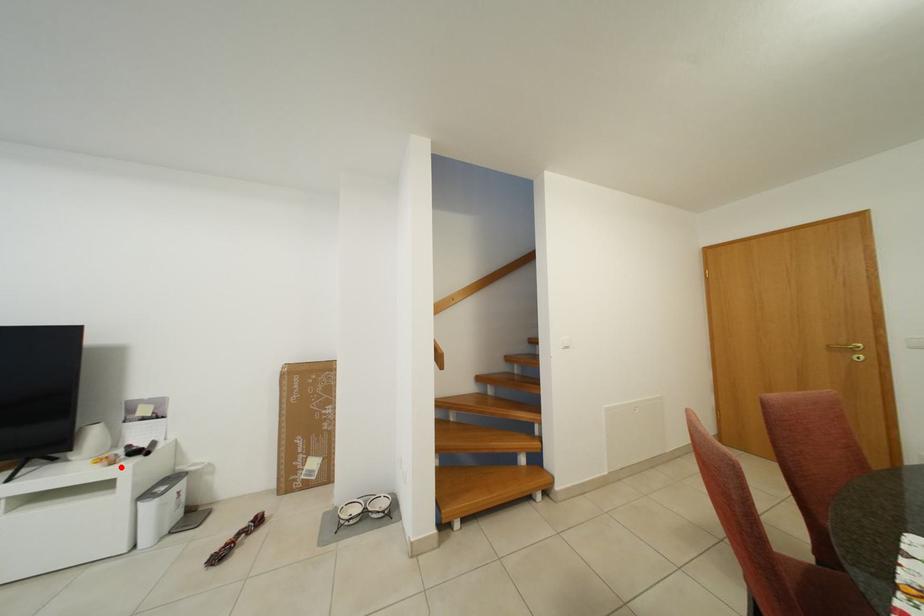
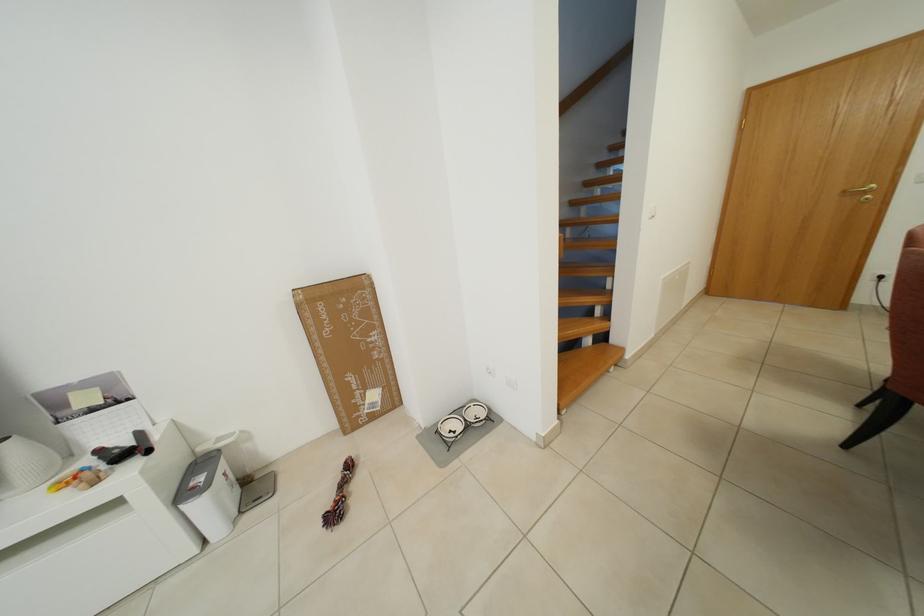
Question: I am providing you with two images of the same scene from different viewpoints. Given a red point in image1, look at the same physical point in image2. Is it:

Choices:
 (A) Closer to the viewpoint
 (B) Farther from the viewpoint

Answer: (B)